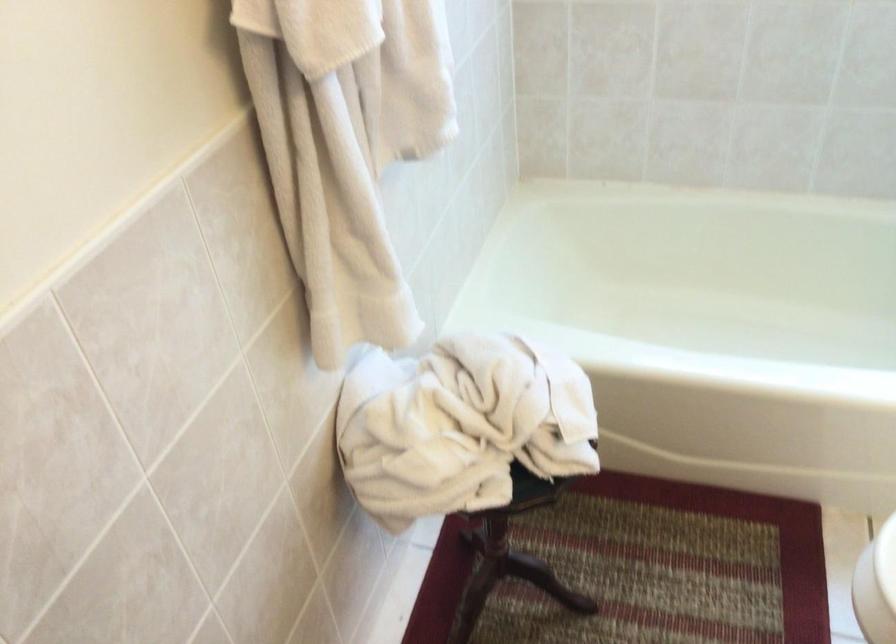
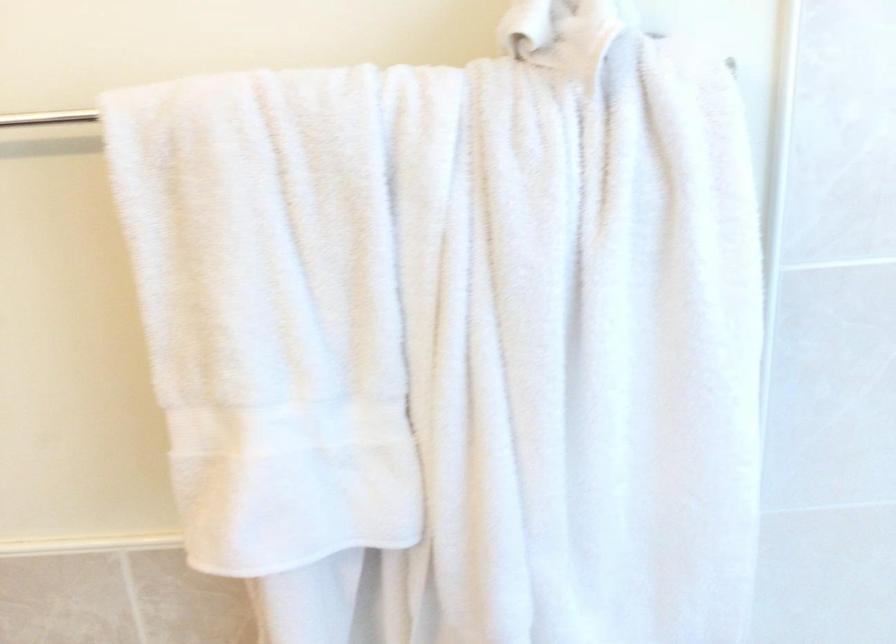
Question: Based on the continuous images, in which direction is the camera rotating? Reply with the corresponding letter.

Choices:
 (A) Left
 (B) Right
 (C) Up
 (D) Down

Answer: (A)